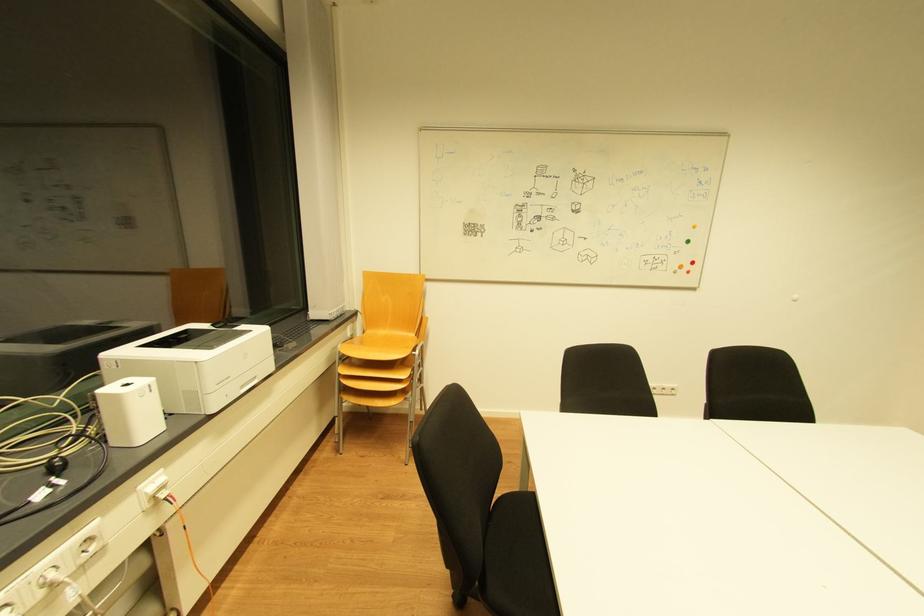
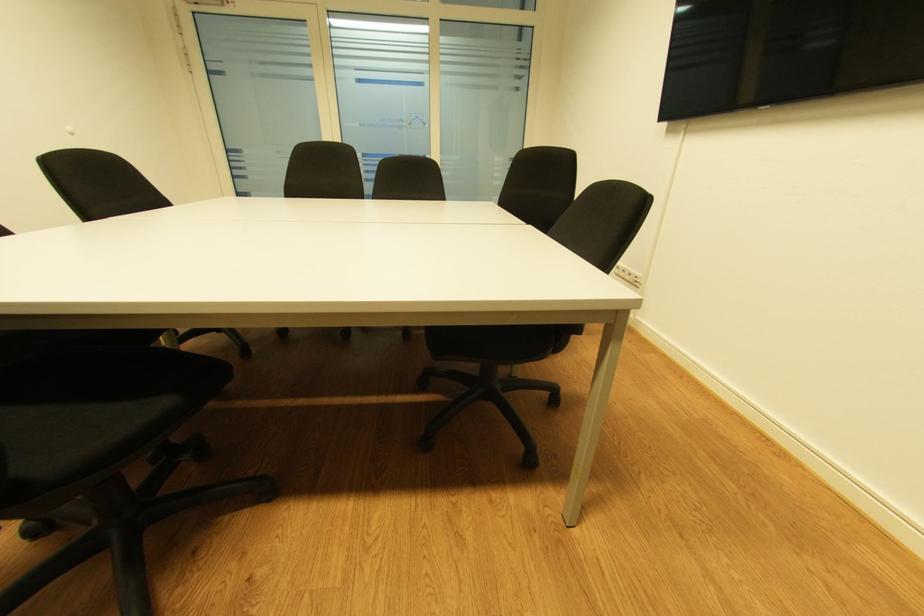
Based on the continuous images, in which direction is the camera rotating?

The camera's rotation is toward right-down.